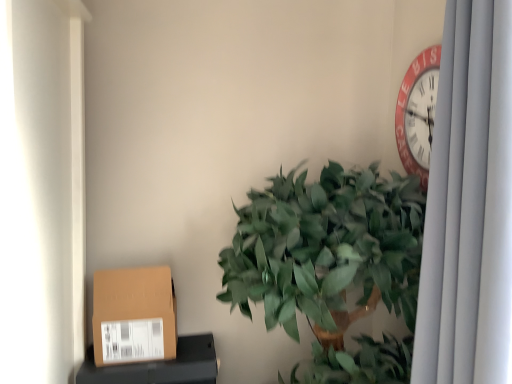
Question: Is brown cardboard box at lower left at the right side of brown cardboard box at lower left?

Choices:
 (A) no
 (B) yes

Answer: (B)

Question: From the image's perspective, is brown cardboard box at lower left located above brown cardboard box at lower left?

Choices:
 (A) yes
 (B) no

Answer: (B)

Question: Are brown cardboard box at lower left and brown cardboard box at lower left far apart?

Choices:
 (A) no
 (B) yes

Answer: (A)

Question: Can you confirm if brown cardboard box at lower left is positioned to the left of brown cardboard box at lower left?

Choices:
 (A) yes
 (B) no

Answer: (B)

Question: Is brown cardboard box at lower left located outside brown cardboard box at lower left?

Choices:
 (A) yes
 (B) no

Answer: (A)

Question: From the image's perspective, is white fabric curtain at right positioned above or below brown cardboard box at lower left?

Choices:
 (A) below
 (B) above

Answer: (B)

Question: From their relative heights in the image, would you say white fabric curtain at right is taller or shorter than brown cardboard box at lower left?

Choices:
 (A) tall
 (B) short

Answer: (A)

Question: From a real-world perspective, is white fabric curtain at right positioned above or below brown cardboard box at lower left?

Choices:
 (A) above
 (B) below

Answer: (A)

Question: Visually, is white fabric curtain at right positioned to the left or to the right of brown cardboard box at lower left?

Choices:
 (A) left
 (B) right

Answer: (B)

Question: Relative to green leafy plant at center, is brown cardboard box at lower left in front or behind?

Choices:
 (A) behind
 (B) front

Answer: (A)

Question: In the image, is brown cardboard box at lower left on the left side or the right side of green leafy plant at center?

Choices:
 (A) right
 (B) left

Answer: (B)

Question: Considering the positions of brown cardboard box at lower left and green leafy plant at center in the image, is brown cardboard box at lower left wider or thinner than green leafy plant at center?

Choices:
 (A) thin
 (B) wide

Answer: (A)

Question: Do you think brown cardboard box at lower left is within green leafy plant at center, or outside of it?

Choices:
 (A) inside
 (B) outside

Answer: (B)

Question: In terms of height, does green leafy plant at center look taller or shorter compared to brown cardboard box at lower left?

Choices:
 (A) short
 (B) tall

Answer: (B)

Question: From the image's perspective, is green leafy plant at center above or below brown cardboard box at lower left?

Choices:
 (A) below
 (B) above

Answer: (B)